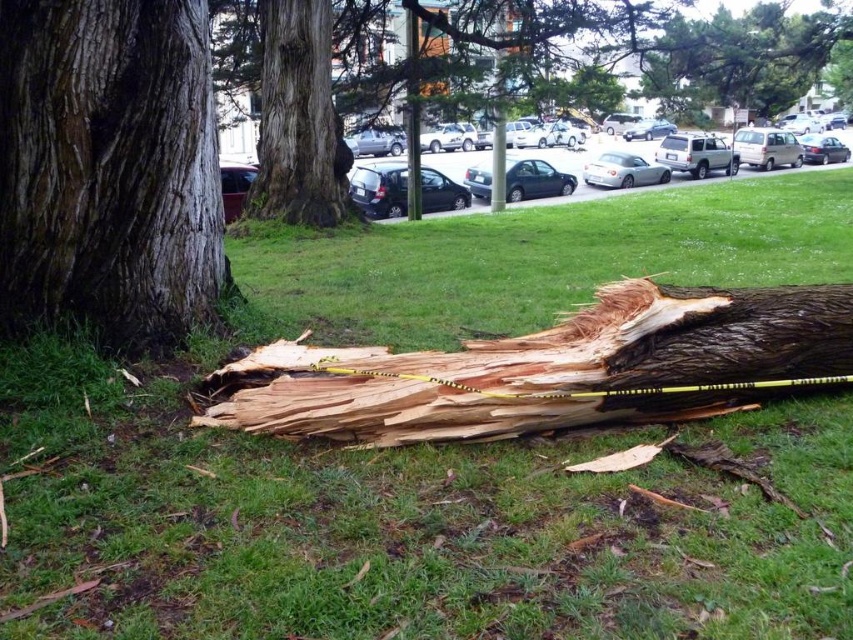
Which is in front, point (85, 38) or point (410, 435)?

Point (410, 435)

Find the location of a particular element. This screenshot has width=853, height=640. dark brown rough bark at center is located at coordinates (108, 170).

Find the location of a particular element. The height and width of the screenshot is (640, 853). dark brown rough bark at center is located at coordinates (108, 170).

Between green grass at lower center and natural wood log at center, which one appears on the right side from the viewer's perspective?

natural wood log at center

Is green grass at lower center smaller than natural wood log at center?

Yes.

Is point (821, 586) more distant than point (526, 381)?

That is False.

You are a GUI agent. You are given a task and a screenshot of the screen. Output one action in this format:
    pyautogui.click(x=<x>, y=<y>)
    Task: Click on the green grass at lower center
    
    Given the screenshot: What is the action you would take?
    pyautogui.click(x=436, y=454)

Between natural wood log at center and smooth brown tree trunk at center, which one has less height?

With less height is natural wood log at center.

Does point (556, 340) come in front of point (274, 60)?

That is True.

You are a GUI agent. You are given a task and a screenshot of the screen. Output one action in this format:
    pyautogui.click(x=<x>, y=<y>)
    Task: Click on the natural wood log at center
    The image size is (853, 640).
    Given the screenshot: What is the action you would take?
    pyautogui.click(x=552, y=369)